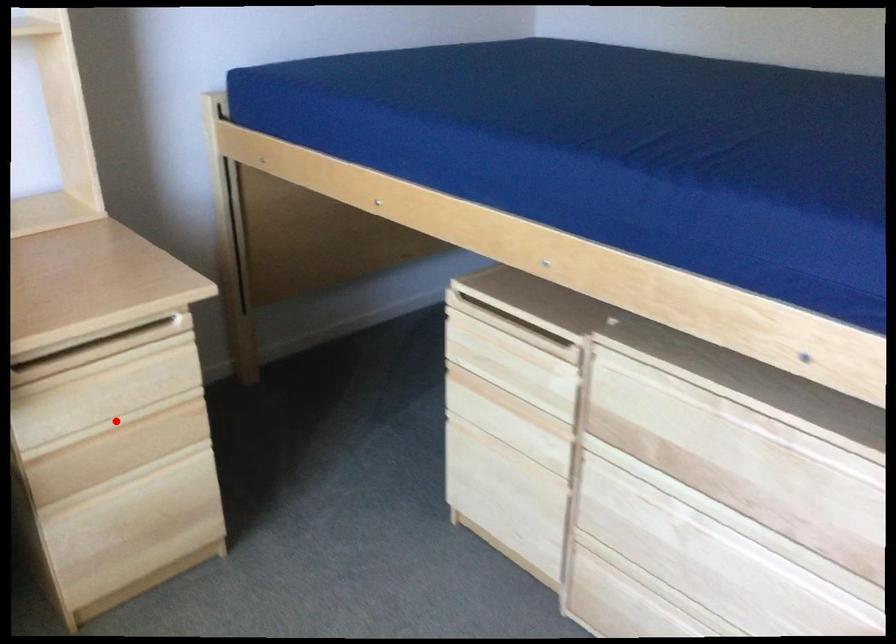
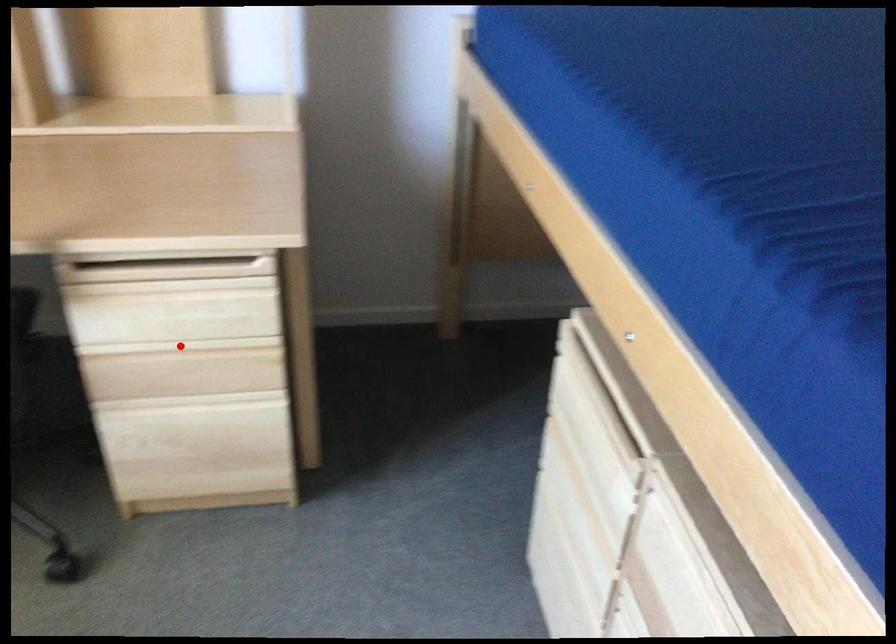
I am providing you with two images of the same scene from different viewpoints. A red point is marked on the first image and another point is marked on the second image. Do the highlighted points in image1 and image2 indicate the same real-world spot?

Yes